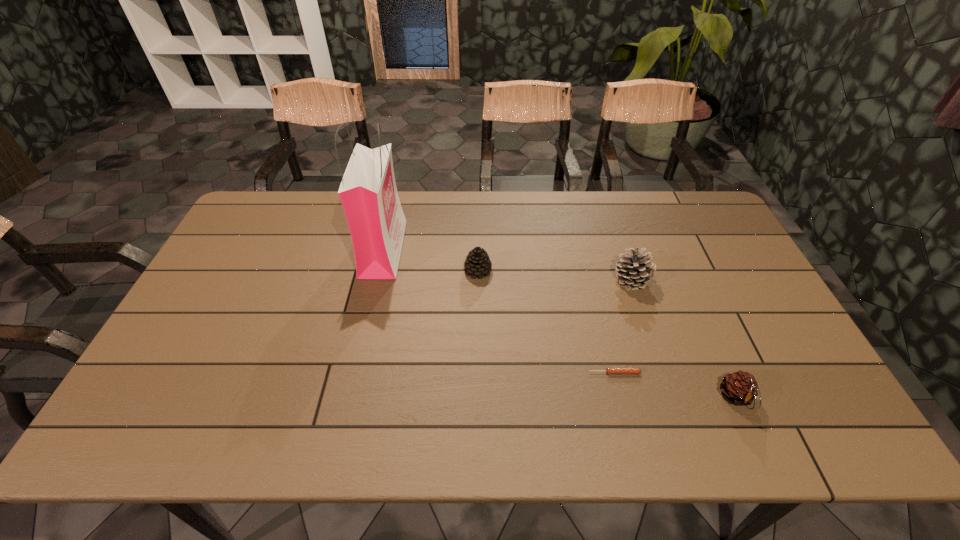
At what (x,y) coordinates should I click in order to perform the action: click on empty space between the sausage and the leftmost pinecone. Please return your answer as a coordinate pair (x, y). Looking at the image, I should click on (546, 322).

This screenshot has width=960, height=540. I want to click on free space that is in between the fourth shortest object and the rightmost pinecone, so click(684, 339).

Where is `vacant space in between the leftmost pinecone and the leftmost object`? The width and height of the screenshot is (960, 540). vacant space in between the leftmost pinecone and the leftmost object is located at coordinates (431, 260).

Find the location of a particular element. This screenshot has width=960, height=540. empty location between the shopping bag and the nearest object is located at coordinates (560, 323).

Where is `free point between the second object from left to right and the nearest object`? free point between the second object from left to right and the nearest object is located at coordinates click(x=607, y=334).

I want to click on free space between the nearest pinecone and the shortest object, so click(675, 385).

Locate an element on the screen. The image size is (960, 540). vacant space in between the second pinecone from right to left and the tallest object is located at coordinates (508, 265).

This screenshot has height=540, width=960. I want to click on vacant space in between the leftmost pinecone and the rightmost pinecone, so click(x=607, y=334).

Find the location of a particular element. free spot between the leftmost object and the second object from left to right is located at coordinates pos(431,260).

Where is `the third closest object to the second object from left to right`? the third closest object to the second object from left to right is located at coordinates (609, 370).